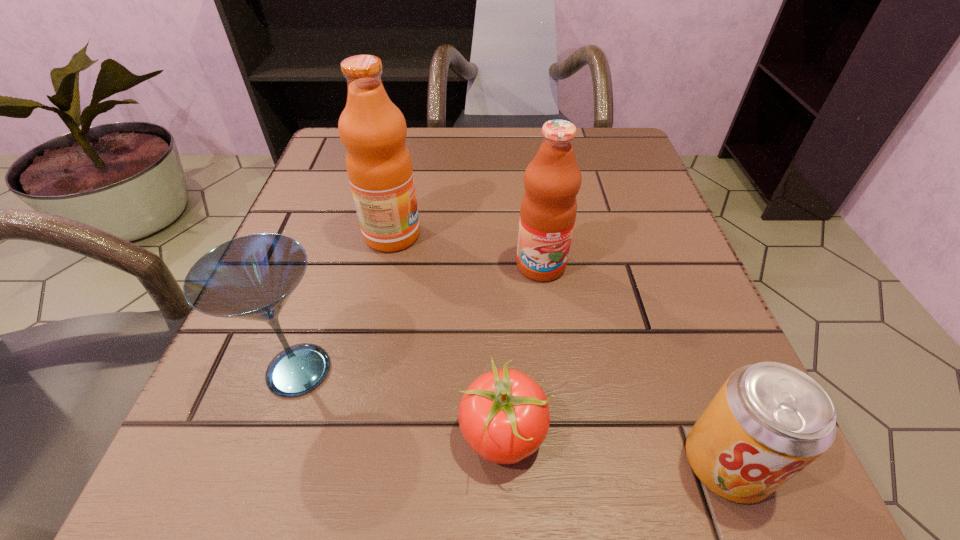
Image resolution: width=960 pixels, height=540 pixels. In order to click on the left fruit juice in this screenshot , I will do `click(373, 130)`.

The image size is (960, 540). Identify the location of the taller fruit juice. (373, 130).

At what (x,y) coordinates should I click in order to perform the action: click on the second tallest object. Please return your answer as a coordinate pair (x, y). Looking at the image, I should click on (552, 180).

Locate an element on the screen. the shorter fruit juice is located at coordinates (552, 180).

Where is `martini`? martini is located at coordinates (251, 277).

Find the location of a particular element. The image size is (960, 540). the rightmost object is located at coordinates (769, 420).

Where is `the second shortest object`? Image resolution: width=960 pixels, height=540 pixels. the second shortest object is located at coordinates (769, 420).

This screenshot has width=960, height=540. In order to click on tomato in this screenshot , I will do `click(504, 416)`.

The image size is (960, 540). What are the coordinates of `free space located on the label side of the taller fruit juice` in the screenshot? It's located at (485, 235).

Locate an element on the screen. This screenshot has width=960, height=540. vacant region located 0.070m on the front label of the second tallest object is located at coordinates (548, 319).